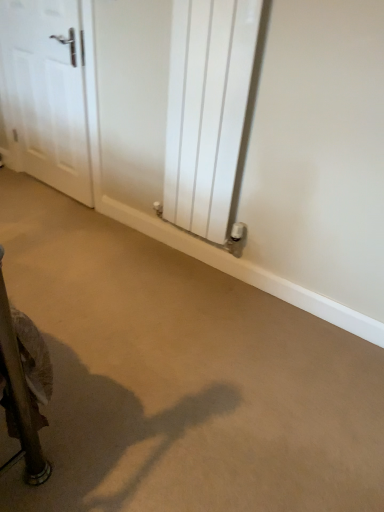
Image resolution: width=384 pixels, height=512 pixels. What do you see at coordinates (46, 93) in the screenshot? I see `white glossy door at upper left` at bounding box center [46, 93].

Identify the location of beige carpet at center. (182, 377).

Measure the distance between white glossy door at upper left and white metallic radiator at center.

white glossy door at upper left and white metallic radiator at center are 34.11 inches apart from each other.

Is white glossy door at upper left thinner than white metallic radiator at center?

Yes, white glossy door at upper left is thinner than white metallic radiator at center.

From the image's perspective, is white glossy door at upper left positioned above or below white metallic radiator at center?

white glossy door at upper left is situated higher than white metallic radiator at center in the image.

Which is less distant, (14, 39) or (239, 2)?

The point (239, 2) is in front.

From a real-world perspective, who is located higher, beige carpet at center or white glossy door at upper left?

white glossy door at upper left is physically above.

From the image's perspective, is beige carpet at center located beneath white glossy door at upper left?

Yes, from the image's perspective, beige carpet at center is below white glossy door at upper left.

What are the coordinates of `door that appears above the beige carpet at center (from the image's perspective)` in the screenshot? It's located at (46, 93).

Which object is wider, white metallic radiator at center or beige carpet at center?

beige carpet at center is wider.

Is white metallic radiator at center taller than beige carpet at center?

Yes.

From a real-world perspective, is white metallic radiator at center located beneath beige carpet at center?

Incorrect, from a real-world perspective, white metallic radiator at center is higher than beige carpet at center.

From a real-world perspective, is white metallic radiator at center physically below white glossy door at upper left?

No, from a real-world perspective, white metallic radiator at center is not under white glossy door at upper left.

Is white metallic radiator at center outside of white glossy door at upper left?

That's correct, white metallic radiator at center is outside of white glossy door at upper left.

In terms of height, does white metallic radiator at center look taller or shorter compared to white glossy door at upper left?

Considering their sizes, white metallic radiator at center has more height than white glossy door at upper left.

Can you tell me how much white metallic radiator at center and white glossy door at upper left differ in facing direction?

The angle between the facing direction of white metallic radiator at center and the facing direction of white glossy door at upper left is 0.301 degrees.

Is white glossy door at upper left to the left or to the right of beige carpet at center in the image?

Clearly, white glossy door at upper left is on the left of beige carpet at center in the image.

Is the position of white glossy door at upper left less distant than that of beige carpet at center?

No, white glossy door at upper left is further to the viewer.

Which of these two, white glossy door at upper left or beige carpet at center, is bigger?

beige carpet at center.

Considering the sizes of objects beige carpet at center and white metallic radiator at center in the image provided, who is smaller, beige carpet at center or white metallic radiator at center?

white metallic radiator at center.

What's the angular difference between beige carpet at center and white metallic radiator at center's facing directions?

90 degrees separate the facing orientations of beige carpet at center and white metallic radiator at center.

Is beige carpet at center wider or thinner than white metallic radiator at center?

Considering their sizes, beige carpet at center looks broader than white metallic radiator at center.

Is point (301, 312) positioned after point (186, 123)?

Yes.

At what (x,y) coordinates should I click in order to perform the action: click on radiator above the white glossy door at upper left (from a real-world perspective). Please return your answer as a coordinate pair (x, y). Looking at the image, I should click on (207, 110).

Locate an element on the screen. This screenshot has width=384, height=512. concrete in front of the white glossy door at upper left is located at coordinates (182, 377).

Considering their positions, is beige carpet at center positioned closer to white glossy door at upper left than white metallic radiator at center?

white metallic radiator at center is positioned closer to the anchor white glossy door at upper left.

Which object lies nearer to the anchor point beige carpet at center, white glossy door at upper left or white metallic radiator at center?

white metallic radiator at center.

Looking at the image, which one is located further to white metallic radiator at center, beige carpet at center or white glossy door at upper left?

white glossy door at upper left is positioned further to the anchor white metallic radiator at center.

Looking at the image, which one is located further to white glossy door at upper left, white metallic radiator at center or beige carpet at center?

beige carpet at center is further to white glossy door at upper left.

Based on their spatial positions, is white glossy door at upper left or beige carpet at center further from white metallic radiator at center?

white glossy door at upper left.

Based on their spatial positions, is white metallic radiator at center or white glossy door at upper left closer to beige carpet at center?

Based on the image, white metallic radiator at center appears to be nearer to beige carpet at center.

Identify the location of radiator located between beige carpet at center and white glossy door at upper left in the depth direction. The width and height of the screenshot is (384, 512). (207, 110).